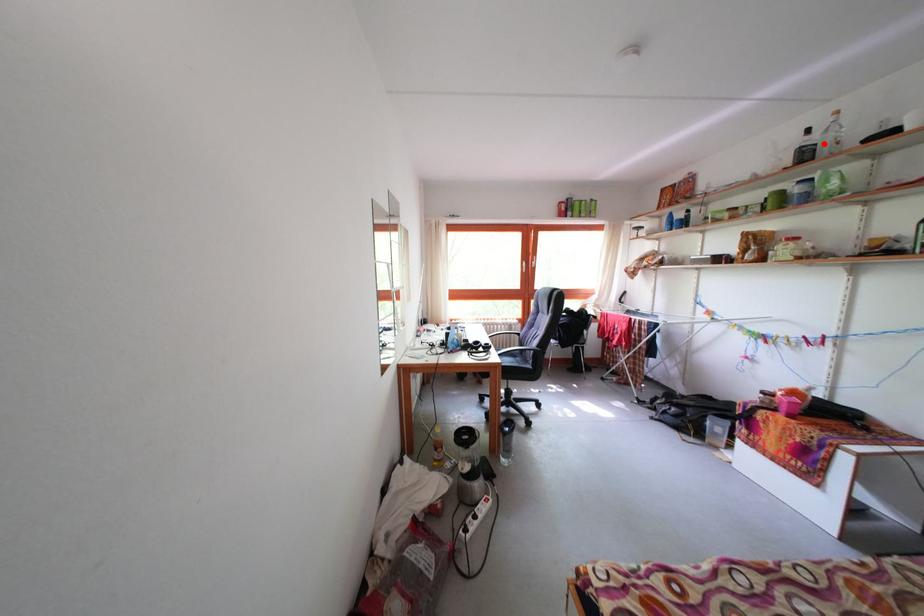
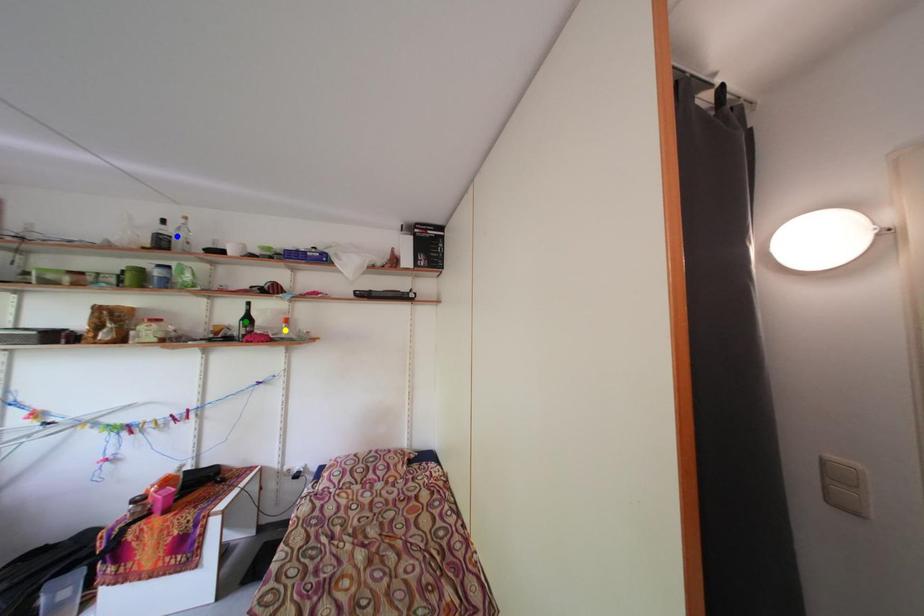
Question: I am providing you with two images of the same scene from different viewpoints. A red point is marked on the first image. You are given multiple points on the second image. Can you choose the point in image 2 that corresponds to the point in image 1?

Choices:
 (A) blue point
 (B) green point
 (C) yellow point

Answer: (A)